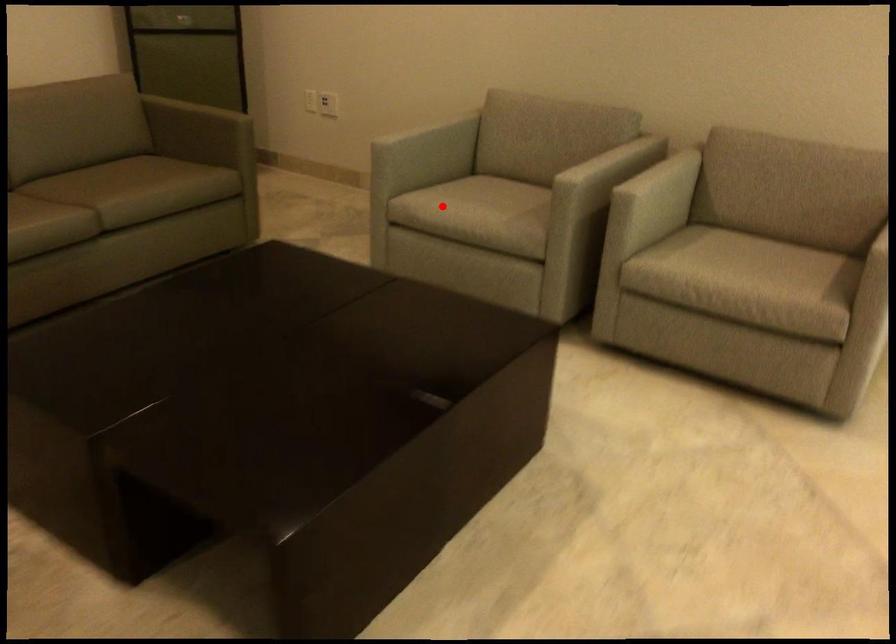
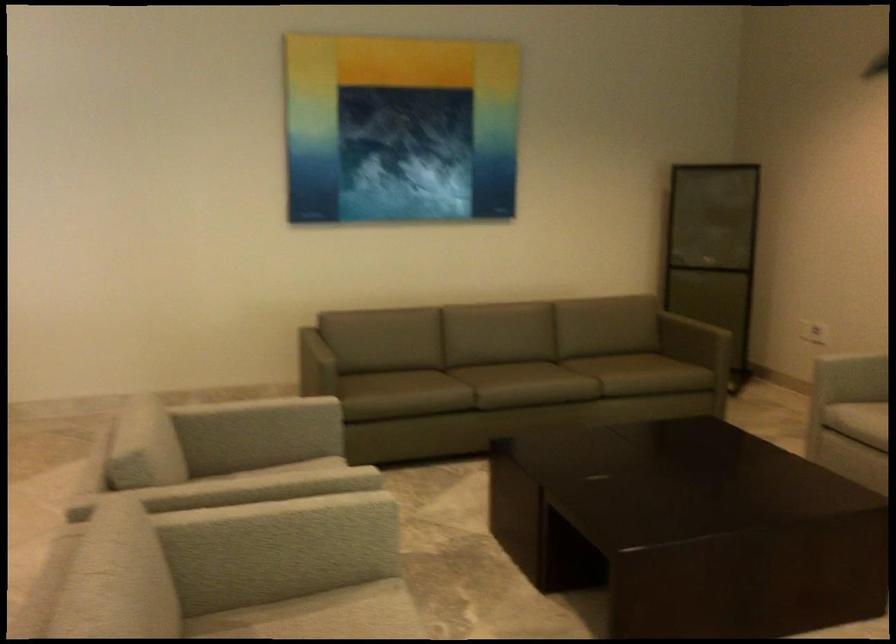
Question: I am providing you with two images of the same scene from different viewpoints. A red point is shown in image1. For the corresponding object point in image2, is it positioned nearer or farther from the camera?

Choices:
 (A) Nearer
 (B) Farther

Answer: (B)